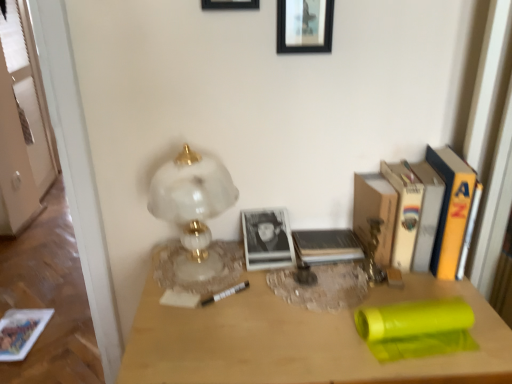
This screenshot has width=512, height=384. Identify the location of vacant area situated below matte paper book at lower left (from a real-world perspective). (16, 330).